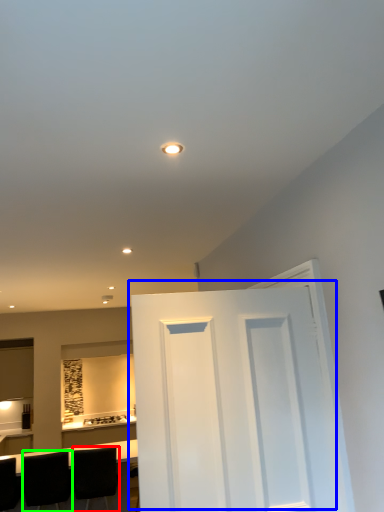
Question: Considering the real-world distances, which object is closest to chair (highlighted by a red box)? door (highlighted by a blue box) or chair (highlighted by a green box).

Choices:
 (A) door
 (B) chair

Answer: (B)